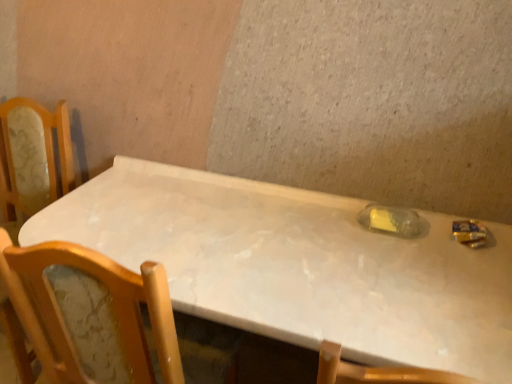
Where is `vacant area in front of translucent plastic bottle at center`? The height and width of the screenshot is (384, 512). vacant area in front of translucent plastic bottle at center is located at coordinates (413, 258).